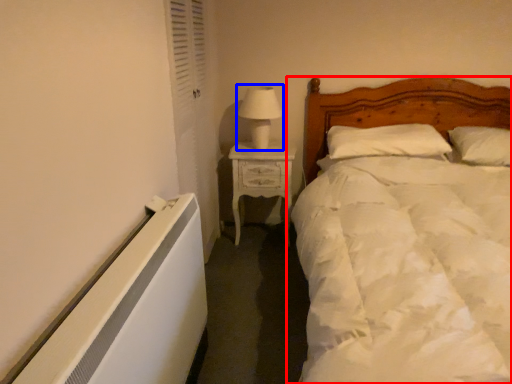
Question: Among these objects, which one is farthest to the camera, bed (highlighted by a red box) or table lamp (highlighted by a blue box)?

Choices:
 (A) bed
 (B) table lamp

Answer: (B)